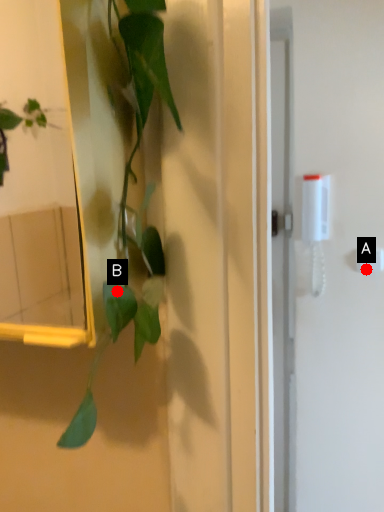
Question: Two points are circled on the image, labeled by A and B beside each circle. Which point appears closest to the camera in this image?

Choices:
 (A) A is closer
 (B) B is closer

Answer: (B)